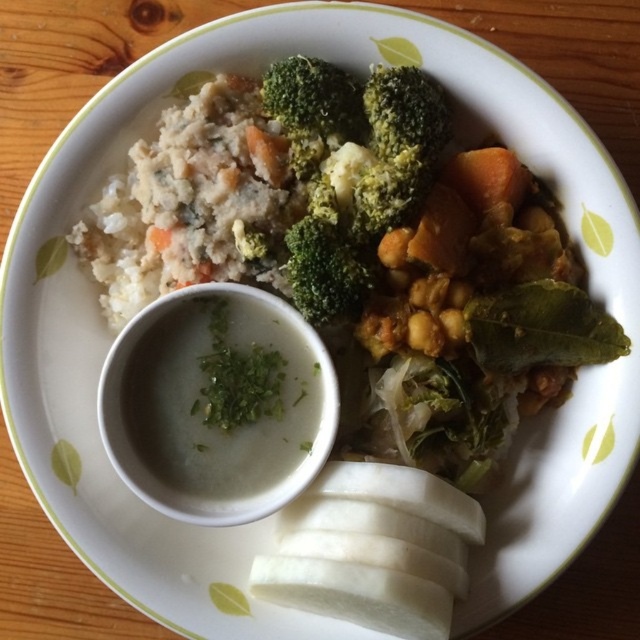
You are a food critic looking at this plate of food. Which of the two items, the white fluffy rice at upper left or the white creamy soup at center, is positioned farther to the left?

The white fluffy rice at upper left is positioned farther to the left compared to the white creamy soup at center.

You are a food critic evaluating this dish. You notice two items at the center of the plate, the white creamy soup at center and the green matte broccoli at center. Which one appears closer to you when looking at the plate?

The white creamy soup at center is further to the viewer than the green matte broccoli at center, so the white creamy soup at center appears closer to you.

You are a food critic evaluating the presentation of this dish. Based on the height of the white fluffy rice at upper left and the green matte broccoli at center, which component appears to be taller?

The green matte broccoli at center is taller than the white fluffy rice at upper left according to the description.